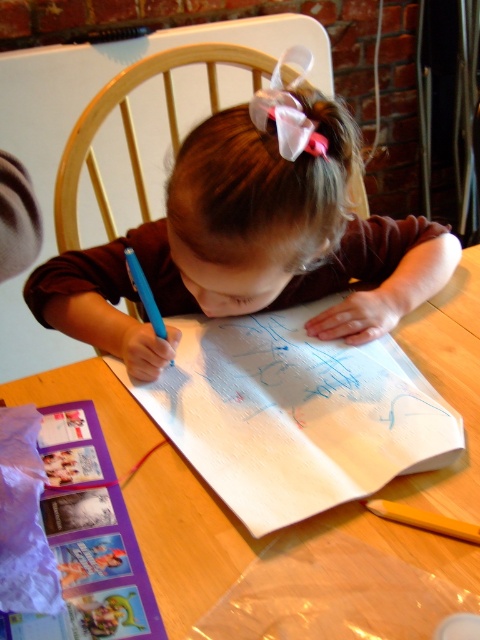
Between white textured paper at center and wooden table at center, which one is positioned higher?

Positioned higher is wooden table at center.

Does white textured paper at center appear on the left side of wooden table at center?

Indeed, white textured paper at center is positioned on the left side of wooden table at center.

You are a GUI agent. You are given a task and a screenshot of the screen. Output one action in this format:
    pyautogui.click(x=<x>, y=<y>)
    Task: Click on the white textured paper at center
    The width and height of the screenshot is (480, 640).
    Given the screenshot: What is the action you would take?
    pyautogui.click(x=294, y=413)

The height and width of the screenshot is (640, 480). Find the location of `white textured paper at center`. white textured paper at center is located at coordinates (294, 413).

Between brown matte shirt at center and blue plastic pen at center, which one is positioned higher?

brown matte shirt at center

You are a GUI agent. You are given a task and a screenshot of the screen. Output one action in this format:
    pyautogui.click(x=<x>, y=<y>)
    Task: Click on the brown matte shirt at center
    
    Given the screenshot: What is the action you would take?
    pyautogui.click(x=253, y=209)

Image resolution: width=480 pixels, height=640 pixels. Identify the location of wooden table at center. (184, 540).

Is wooden table at center positioned at the back of wooden crayon at lower right?

That is False.

Measure the distance between wooden table at center and camera.

wooden table at center and camera are 16.78 inches apart from each other.

The height and width of the screenshot is (640, 480). In order to click on wooden table at center in this screenshot , I will do `click(184, 540)`.